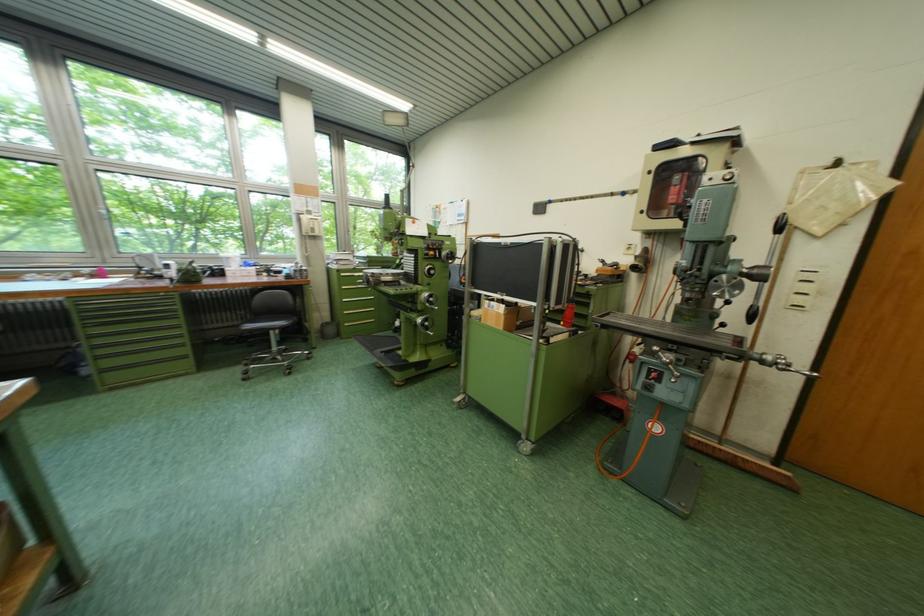
Locate an element on the screen. white telephone handset is located at coordinates (306, 224).